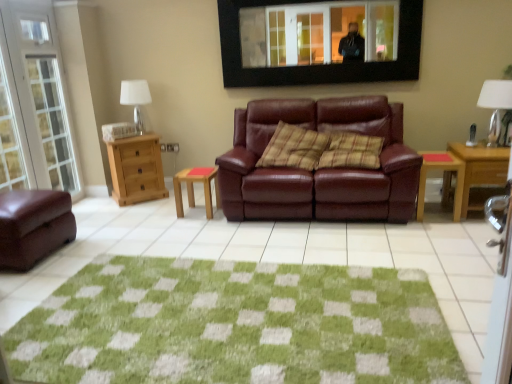
Image resolution: width=512 pixels, height=384 pixels. What are the coordinates of `free spot to the left of wooden stool at center, marked as the first table in a left-to-right arrangement` in the screenshot? It's located at (164, 213).